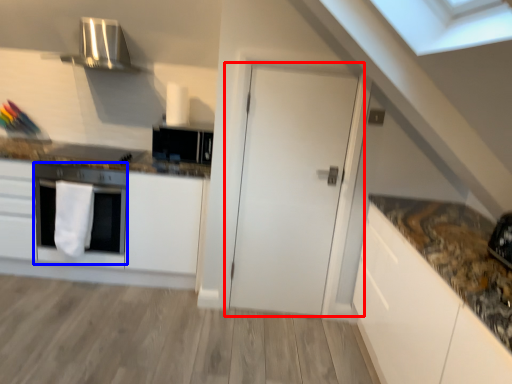
Question: Which object is closer to the camera taking this photo, door (highlighted by a red box) or oven (highlighted by a blue box)?

Choices:
 (A) door
 (B) oven

Answer: (A)